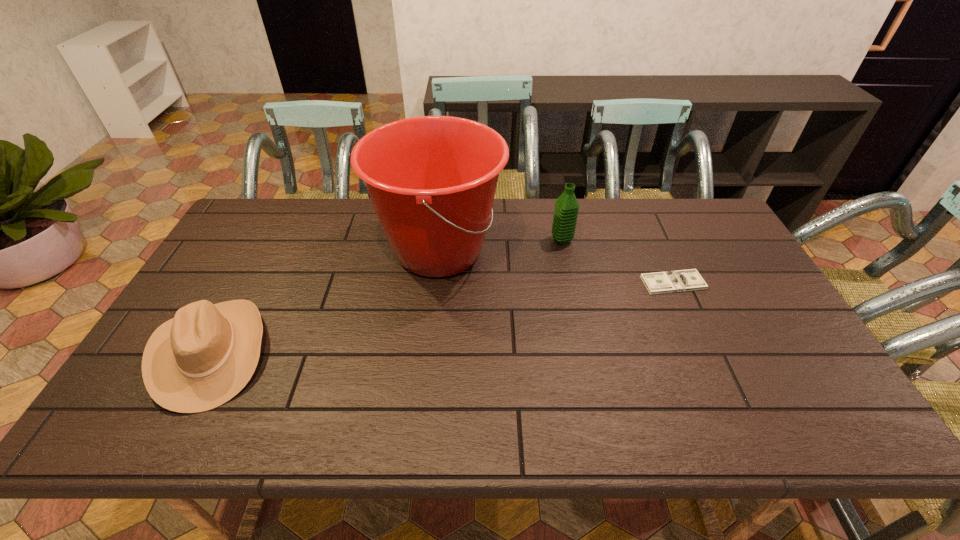
This screenshot has height=540, width=960. I want to click on free space between the second object from right to left and the leftmost object, so click(x=386, y=296).

This screenshot has width=960, height=540. Find the location of `object that is the closest to the tallest object`. object that is the closest to the tallest object is located at coordinates (566, 209).

In order to click on the third closest object to the leftmost object in this screenshot , I will do click(x=681, y=280).

Identify the location of vacant space that satisfies the following two spatial constraints: 1. with the handle attached to the rim of the shortest object; 2. on the right side of the bucket. (436, 283).

Where is `free space that satisfies the following two spatial constraints: 1. with the handle attached to the rim of the second object from left to right; 2. on the front side of the cowboy hat`? free space that satisfies the following two spatial constraints: 1. with the handle attached to the rim of the second object from left to right; 2. on the front side of the cowboy hat is located at coordinates (428, 352).

At what (x,y) coordinates should I click in order to perform the action: click on vacant area that satisfies the following two spatial constraints: 1. with the handle attached to the rim of the tallest object; 2. on the front side of the cowboy hat. Please return your answer as a coordinate pair (x, y). The width and height of the screenshot is (960, 540). Looking at the image, I should click on (428, 352).

You are a GUI agent. You are given a task and a screenshot of the screen. Output one action in this format:
    pyautogui.click(x=<x>, y=<y>)
    Task: Click on the blank space that satisfies the following two spatial constraints: 1. on the back side of the dollar; 2. with the handle attached to the rim of the bucket
    
    Given the screenshot: What is the action you would take?
    pyautogui.click(x=659, y=251)